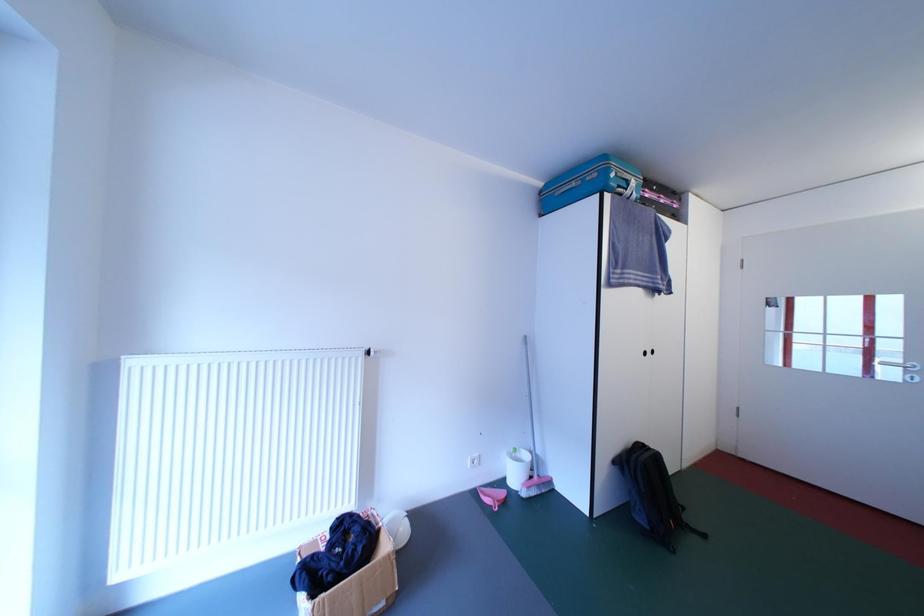
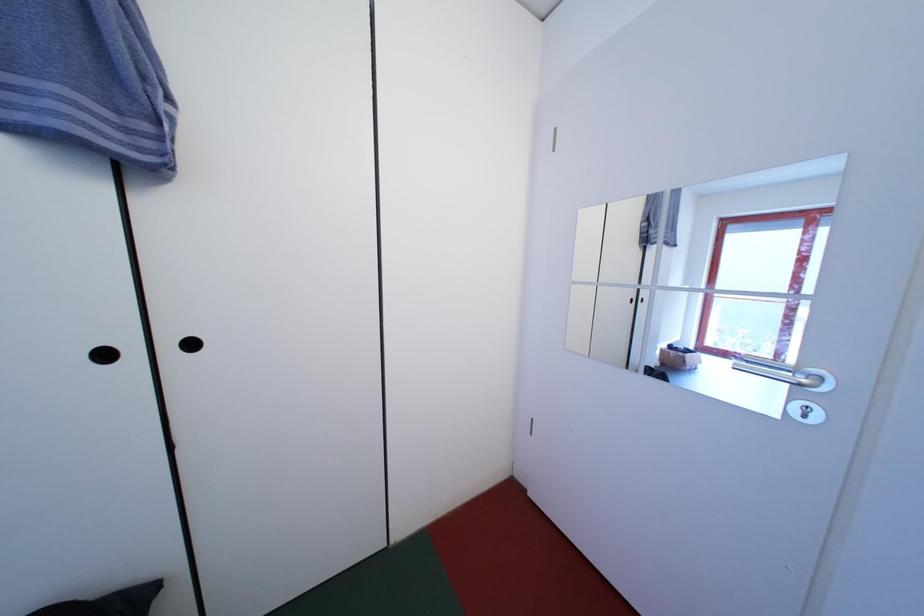
The images are taken continuously from a first-person perspective. In which direction are you moving?

The cameraman walked toward right, forward.